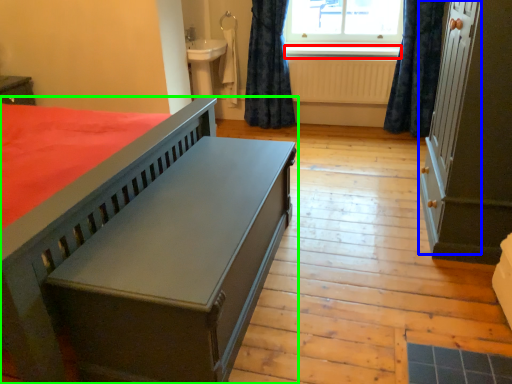
Question: Considering the real-world distances, which object is farthest from window sill (highlighted by a red box)? screen door (highlighted by a blue box) or bed (highlighted by a green box)?

Choices:
 (A) screen door
 (B) bed

Answer: (B)